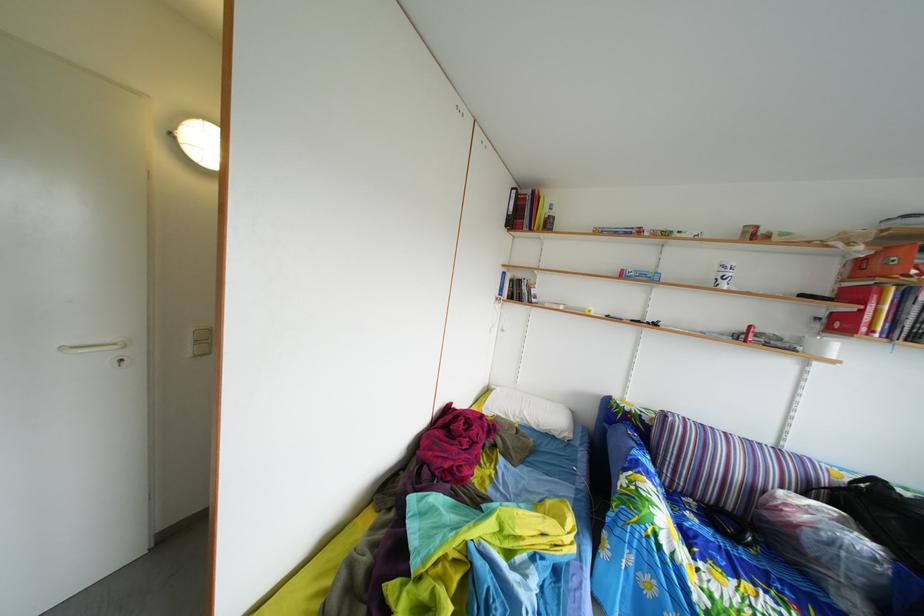
The location [898,265] corresponds to which object?

This point indicates the orange box.